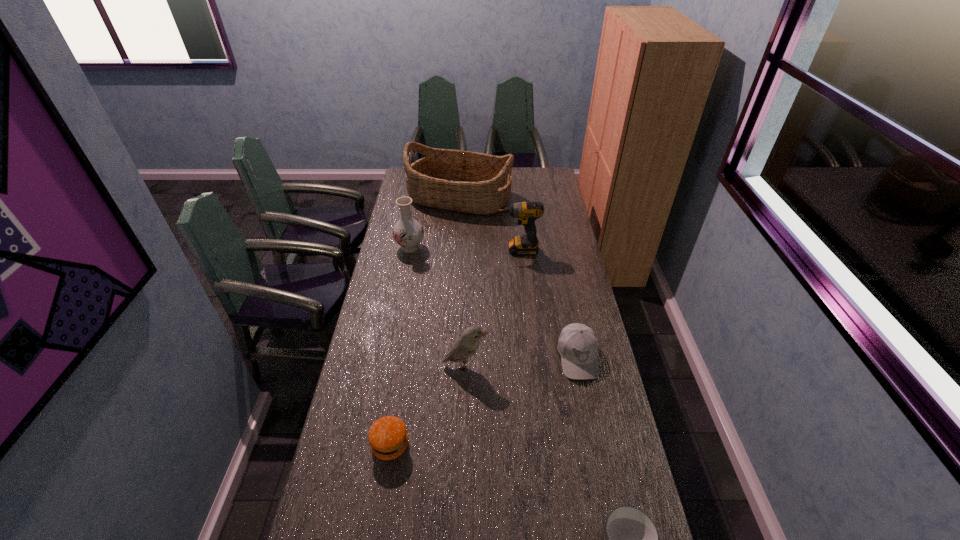
Find the location of a particular element. basket is located at coordinates (471, 182).

Identify the location of drill. Image resolution: width=960 pixels, height=540 pixels. (526, 213).

Image resolution: width=960 pixels, height=540 pixels. Identify the location of vase. (407, 232).

Find the location of `the fourth tallest object`. the fourth tallest object is located at coordinates (466, 346).

Where is `baseball cap`? This screenshot has height=540, width=960. baseball cap is located at coordinates (578, 345).

Image resolution: width=960 pixels, height=540 pixels. I want to click on the sixth farthest object, so click(x=387, y=436).

I want to click on the second shortest object, so click(387, 436).

You are a GUI agent. You are given a task and a screenshot of the screen. Output one action in this format:
    pyautogui.click(x=<x>, y=<y>)
    Task: Click on the vacant space located on the back of the basket
    This screenshot has height=540, width=960.
    Given the screenshot: What is the action you would take?
    pyautogui.click(x=461, y=172)

Locate an element on the screen. This screenshot has width=960, height=540. free spot located with the drill bit of the drill facing forward is located at coordinates (448, 250).

Find the location of a particular element. Image resolution: width=960 pixels, height=540 pixels. blank area located 0.370m with the drill bit of the drill facing forward is located at coordinates (414, 250).